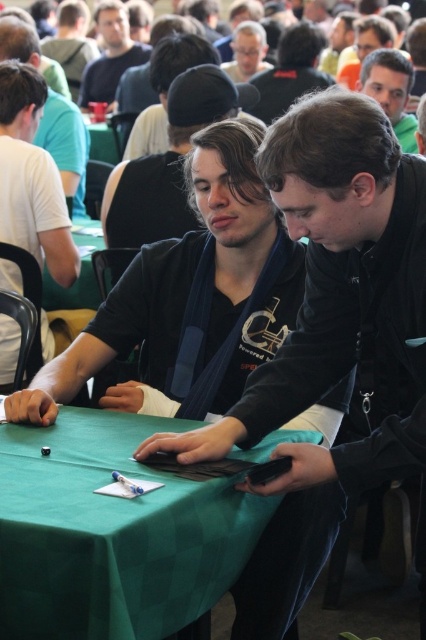
Question: Which object is the closest to the matte black laptop at center?

Choices:
 (A) matte black jacket at upper left
 (B) matte black hair at upper right

Answer: (B)

Question: Can you confirm if matte black laptop at center is thinner than green fabric table at center?

Choices:
 (A) yes
 (B) no

Answer: (B)

Question: Which object appears farthest from the camera in this image?

Choices:
 (A) matte black glasses at upper center
 (B) matte black hair at upper right
 (C) green fabric table at center

Answer: (A)

Question: Which point is closer to the camera?

Choices:
 (A) matte black glasses at upper center
 (B) green checkered table at center
 (C) matte black shirt at upper left
 (D) green fabric table at upper center

Answer: (B)

Question: Is matte black laptop at center smaller than matte black jacket at upper left?

Choices:
 (A) no
 (B) yes

Answer: (B)

Question: Is green checkered table at center smaller than matte black hair at upper right?

Choices:
 (A) yes
 (B) no

Answer: (B)